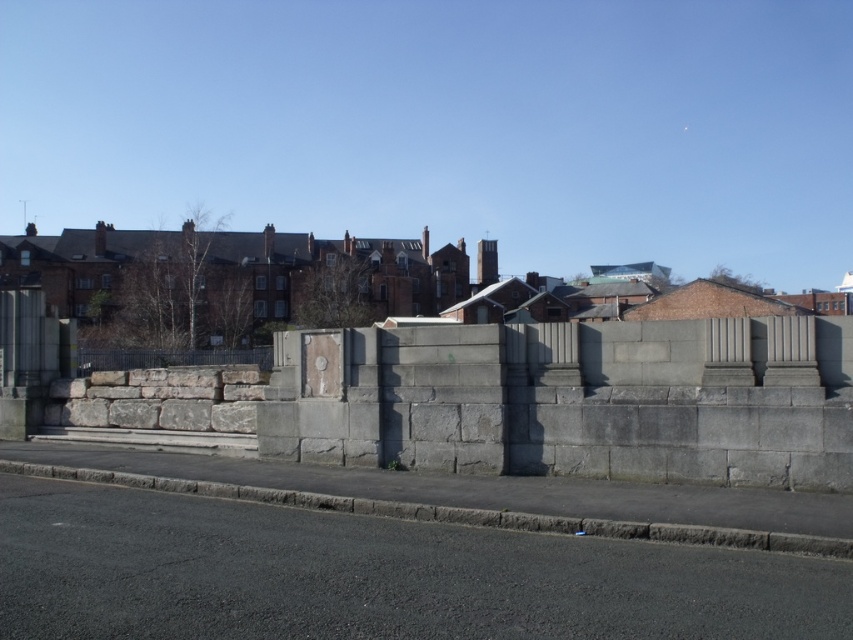
Question: Which point is closer to the camera?

Choices:
 (A) black wrought iron fence at left
 (B) gray stone wall at center

Answer: (B)

Question: Does gray stone wall at center have a smaller size compared to black wrought iron fence at left?

Choices:
 (A) yes
 (B) no

Answer: (A)

Question: In this image, where is gray stone wall at center located relative to black wrought iron fence at left?

Choices:
 (A) left
 (B) right

Answer: (B)

Question: Among these objects, which one is nearest to the camera?

Choices:
 (A) black wrought iron fence at left
 (B) gray stone wall at center

Answer: (B)

Question: Which point is farther to the camera?

Choices:
 (A) black wrought iron fence at left
 (B) gray stone wall at center

Answer: (A)

Question: Can you confirm if gray stone wall at center is bigger than black wrought iron fence at left?

Choices:
 (A) no
 (B) yes

Answer: (A)